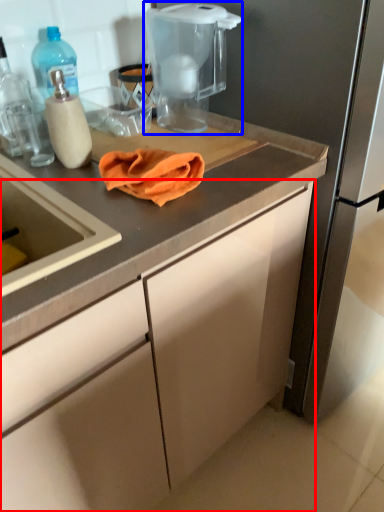
Question: Which point is closer to the camera, cabinetry (highlighted by a red box) or home appliance (highlighted by a blue box)?

Choices:
 (A) cabinetry
 (B) home appliance

Answer: (A)